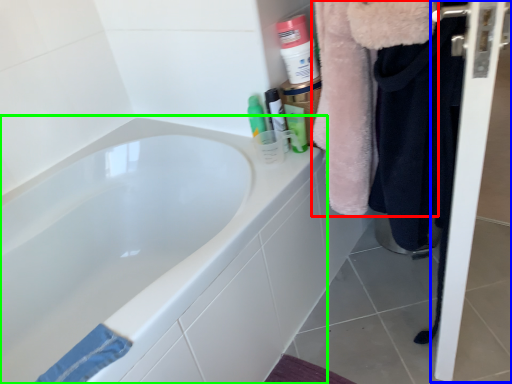
Question: Which object is positioned farthest from fur coat (highlighted by a red box)? Select from screen door (highlighted by a blue box) and bathtub (highlighted by a green box).

Choices:
 (A) screen door
 (B) bathtub

Answer: (B)